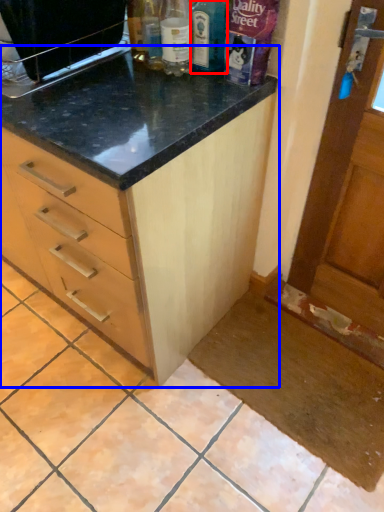
Question: Which object appears farthest to the camera in this image, bottle (highlighted by a red box) or cabinetry (highlighted by a blue box)?

Choices:
 (A) bottle
 (B) cabinetry

Answer: (A)